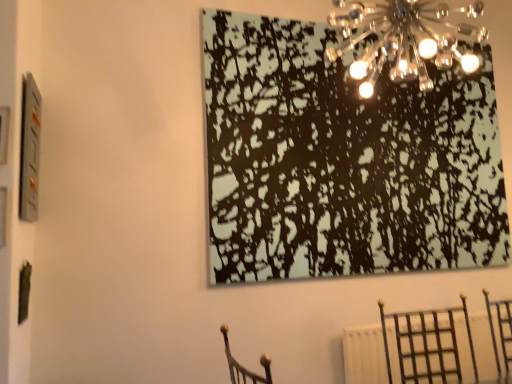
Question: Is metallic glass chandelier at upper center positioned in front of metallic silver picture frame at upper left?

Choices:
 (A) no
 (B) yes

Answer: (B)

Question: From the image's perspective, is metallic glass chandelier at upper center on metallic silver picture frame at upper left?

Choices:
 (A) no
 (B) yes

Answer: (B)

Question: Is metallic glass chandelier at upper center to the right of metallic silver picture frame at upper left from the viewer's perspective?

Choices:
 (A) yes
 (B) no

Answer: (A)

Question: Considering the relative sizes of metallic glass chandelier at upper center and metallic silver picture frame at upper left in the image provided, is metallic glass chandelier at upper center wider than metallic silver picture frame at upper left?

Choices:
 (A) yes
 (B) no

Answer: (A)

Question: Is metallic glass chandelier at upper center looking in the opposite direction of metallic silver picture frame at upper left?

Choices:
 (A) no
 (B) yes

Answer: (A)

Question: Which is correct: metallic silver picture frame at upper left is inside black textured painting at upper center, or outside of it?

Choices:
 (A) outside
 (B) inside

Answer: (A)

Question: Is metallic silver picture frame at upper left bigger or smaller than black textured painting at upper center?

Choices:
 (A) small
 (B) big

Answer: (A)

Question: In terms of height, does metallic silver picture frame at upper left look taller or shorter compared to black textured painting at upper center?

Choices:
 (A) short
 (B) tall

Answer: (A)

Question: From the image's perspective, is metallic silver picture frame at upper left above or below black textured painting at upper center?

Choices:
 (A) below
 (B) above

Answer: (A)

Question: Visually, is metallic glass chandelier at upper center positioned to the left or to the right of metallic dark brown chair at lower right?

Choices:
 (A) right
 (B) left

Answer: (B)

Question: In terms of width, does metallic glass chandelier at upper center look wider or thinner when compared to metallic dark brown chair at lower right?

Choices:
 (A) thin
 (B) wide

Answer: (A)

Question: Does point (389, 46) appear closer or farther from the camera than point (434, 311)?

Choices:
 (A) closer
 (B) farther

Answer: (A)

Question: Is metallic glass chandelier at upper center in front of or behind metallic dark brown chair at lower right in the image?

Choices:
 (A) behind
 (B) front

Answer: (B)

Question: In the image, is metallic dark brown chair at lower right positioned in front of or behind metallic glass chandelier at upper center?

Choices:
 (A) front
 (B) behind

Answer: (B)

Question: Is metallic dark brown chair at lower right taller or shorter than metallic glass chandelier at upper center?

Choices:
 (A) tall
 (B) short

Answer: (B)